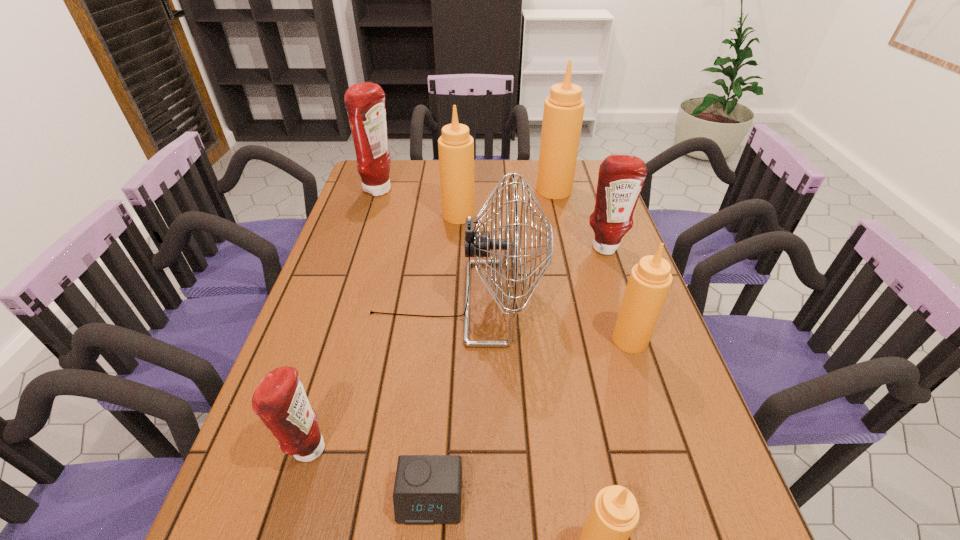
Locate an element on the screen. This screenshot has width=960, height=540. vacant space positioned on the right of the smallest red condiment is located at coordinates (519, 449).

You are a GUI agent. You are given a task and a screenshot of the screen. Output one action in this format:
    pyautogui.click(x=<x>, y=<y>)
    Task: Click on the object present at the far left corner
    
    Given the screenshot: What is the action you would take?
    pyautogui.click(x=365, y=102)

The width and height of the screenshot is (960, 540). I want to click on object that is at the far right corner, so click(563, 113).

Locate an element on the screen. This screenshot has height=540, width=960. free region at the far edge of the desktop is located at coordinates (493, 171).

In the image, there is a desktop. Where is `vacant space at the left edge`? Image resolution: width=960 pixels, height=540 pixels. vacant space at the left edge is located at coordinates (390, 195).

In the image, there is a desktop. What are the coordinates of `vacant space at the right edge` in the screenshot? It's located at [712, 470].

At what (x,y) coordinates should I click in order to perform the action: click on free space at the far left corner of the desktop. Please return your answer as a coordinate pair (x, y). This screenshot has width=960, height=540. Looking at the image, I should click on (x=392, y=171).

The image size is (960, 540). I want to click on free area in between the farthest red condiment and the nearest red condiment, so click(344, 320).

In order to click on free space between the shortest object and the biggest red condiment in this screenshot , I will do `click(405, 345)`.

The width and height of the screenshot is (960, 540). I want to click on empty space between the fan and the third condiment from left to right, so click(x=458, y=259).